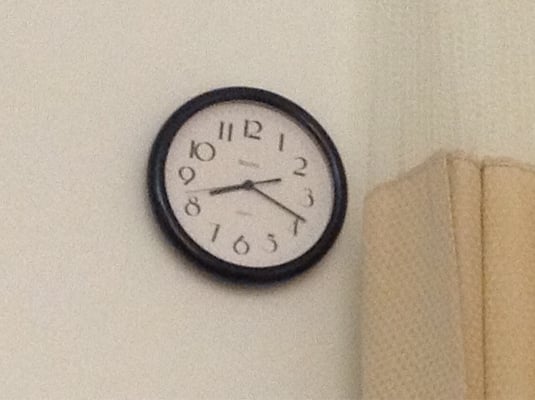
I want to click on clock brand unreadable, so click(249, 163).